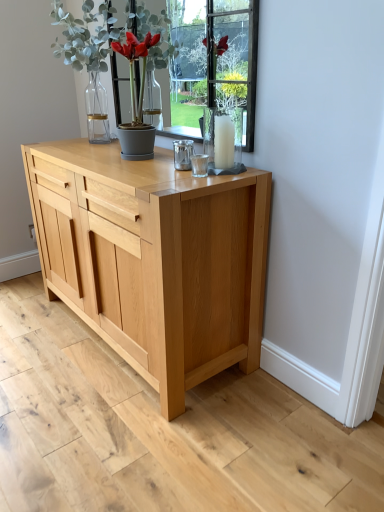
You are a GUI agent. You are given a task and a screenshot of the screen. Output one action in this format:
    pyautogui.click(x=<x>, y=<y>)
    Task: Click on the green matte plant at upper center
    
    Given the screenshot: What is the action you would take?
    pyautogui.click(x=115, y=42)

What do you see at coordinates (223, 140) in the screenshot? The height and width of the screenshot is (512, 384). I see `clear glass candle at center` at bounding box center [223, 140].

Identify the location of green matte plant at upper center. (115, 42).

In terms of size, does clear glass candle at center appear bigger or smaller than natural wood chest of drawers at center?

Considering their sizes, clear glass candle at center takes up less space than natural wood chest of drawers at center.

Which object is more forward, clear glass candle at center or natural wood chest of drawers at center?

natural wood chest of drawers at center.

From the image's perspective, is clear glass candle at center above or below natural wood chest of drawers at center?

Based on their image positions, clear glass candle at center is located above natural wood chest of drawers at center.

Which point is more forward, (206, 121) or (30, 175)?

The point (206, 121) is in front.

From the image's perspective, is natural wood chest of drawers at center above or below green matte plant at upper center?

Clearly, from the image's perspective, natural wood chest of drawers at center is below green matte plant at upper center.

Considering the positions of objects natural wood chest of drawers at center and green matte plant at upper center in the image provided, who is in front, natural wood chest of drawers at center or green matte plant at upper center?

natural wood chest of drawers at center is closer to the camera.

Choose the correct answer: Is natural wood chest of drawers at center inside green matte plant at upper center or outside it?

natural wood chest of drawers at center cannot be found inside green matte plant at upper center.

Who is bigger, natural wood chest of drawers at center or green matte plant at upper center?

natural wood chest of drawers at center is bigger.

From the image's perspective, does green matte plant at upper center appear lower than clear glass candle at center?

Actually, green matte plant at upper center appears above clear glass candle at center in the image.

Is clear glass candle at center inside green matte plant at upper center?

No, clear glass candle at center is not surrounded by green matte plant at upper center.

Is green matte plant at upper center aimed at clear glass candle at center?

No, green matte plant at upper center is not aimed at clear glass candle at center.

How far apart are green matte plant at upper center and clear glass candle at center?

The distance of green matte plant at upper center from clear glass candle at center is 19.04 inches.

Does point (162, 359) come farther from viewer compared to point (224, 121)?

Yes, point (162, 359) is farther from viewer.

From the image's perspective, between natural wood chest of drawers at center and clear glass candle at center, which one is located above?

clear glass candle at center appears higher in the image.

In terms of width, does natural wood chest of drawers at center look wider or thinner when compared to clear glass candle at center?

natural wood chest of drawers at center is wider than clear glass candle at center.

Is natural wood chest of drawers at center not inside clear glass candle at center?

Absolutely, natural wood chest of drawers at center is external to clear glass candle at center.

Is clear glass candle at center taller than green matte plant at upper center?

In fact, clear glass candle at center may be shorter than green matte plant at upper center.

Would you say clear glass candle at center is outside green matte plant at upper center?

clear glass candle at center is positioned outside green matte plant at upper center.

Considering the relative sizes of clear glass candle at center and green matte plant at upper center in the image provided, is clear glass candle at center wider than green matte plant at upper center?

No, clear glass candle at center is not wider than green matte plant at upper center.

Visually, is clear glass candle at center positioned to the left or to the right of green matte plant at upper center?

From the image, it's evident that clear glass candle at center is to the right of green matte plant at upper center.

From the image's perspective, relative to natural wood chest of drawers at center, is green matte plant at upper center above or below?

Based on their image positions, green matte plant at upper center is located above natural wood chest of drawers at center.

Considering the positions of points (130, 56) and (164, 312), is point (130, 56) closer to camera compared to point (164, 312)?

No, (130, 56) is behind (164, 312).

Is green matte plant at upper center in front of natural wood chest of drawers at center?

No.

At what (x,y) coordinates should I click in order to perform the action: click on glass vase above the natural wood chest of drawers at center (from the image's perspective). Please return your answer as a coordinate pair (x, y). The width and height of the screenshot is (384, 512). Looking at the image, I should click on (223, 140).

The image size is (384, 512). In order to click on houseplant that is on the left side of natural wood chest of drawers at center in this screenshot , I will do `click(115, 42)`.

Considering their positions, is natural wood chest of drawers at center positioned closer to clear glass candle at center than green matte plant at upper center?

green matte plant at upper center.

From the image, which object appears to be farther from natural wood chest of drawers at center, green matte plant at upper center or clear glass candle at center?

The object further to natural wood chest of drawers at center is green matte plant at upper center.

Looking at the image, which one is located closer to clear glass candle at center, green matte plant at upper center or natural wood chest of drawers at center?

green matte plant at upper center.

Estimate the real-world distances between objects in this image. Which object is closer to green matte plant at upper center, natural wood chest of drawers at center or clear glass candle at center?

clear glass candle at center lies closer to green matte plant at upper center than the other object.

Considering their positions, is clear glass candle at center positioned further to natural wood chest of drawers at center than green matte plant at upper center?

Based on the image, green matte plant at upper center appears to be further to natural wood chest of drawers at center.

Considering their positions, is clear glass candle at center positioned closer to green matte plant at upper center than natural wood chest of drawers at center?

clear glass candle at center is positioned closer to the anchor green matte plant at upper center.

You are a GUI agent. You are given a task and a screenshot of the screen. Output one action in this format:
    pyautogui.click(x=<x>, y=<y>)
    Task: Click on the glass vase between green matte plant at upper center and natural wood chest of drawers at center vertically
    The width and height of the screenshot is (384, 512).
    Given the screenshot: What is the action you would take?
    pyautogui.click(x=223, y=140)